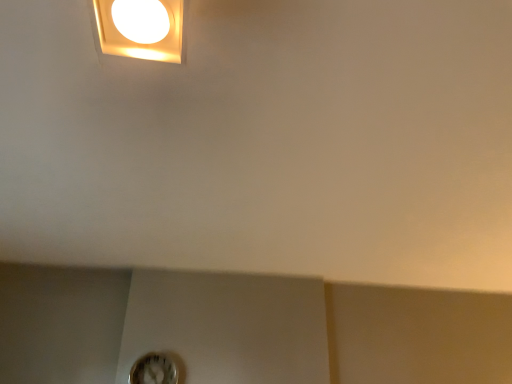
The height and width of the screenshot is (384, 512). What do you see at coordinates (141, 28) in the screenshot? I see `white plastic light fixture at upper left` at bounding box center [141, 28].

Find the location of `white plastic light fixture at upper left`. white plastic light fixture at upper left is located at coordinates (141, 28).

Consider the image. What is the approximate width of white plastic light fixture at upper left?

white plastic light fixture at upper left is 18.30 centimeters in width.

What do you see at coordinates (154, 370) in the screenshot? I see `white plastic clock at lower center` at bounding box center [154, 370].

Locate an element on the screen. white plastic clock at lower center is located at coordinates (154, 370).

Where is `white plastic light fixture at upper left`? The width and height of the screenshot is (512, 384). white plastic light fixture at upper left is located at coordinates (141, 28).

Does white plastic clock at lower center appear on the right side of white plastic light fixture at upper left?

No.

In the scene shown: Considering the positions of objects white plastic clock at lower center and white plastic light fixture at upper left in the image provided, who is in front, white plastic clock at lower center or white plastic light fixture at upper left?

white plastic light fixture at upper left is in front.

Which is nearer, (162, 362) or (165, 3)?

The point (165, 3) is in front.

From the image's perspective, which object appears higher, white plastic clock at lower center or white plastic light fixture at upper left?

white plastic light fixture at upper left appears higher in the image.

From a real-world perspective, is white plastic clock at lower center beneath white plastic light fixture at upper left?

Yes, from a real-world perspective, white plastic clock at lower center is under white plastic light fixture at upper left.

Considering the relative sizes of white plastic clock at lower center and white plastic light fixture at upper left in the image provided, is white plastic clock at lower center thinner than white plastic light fixture at upper left?

Yes.

Who is taller, white plastic clock at lower center or white plastic light fixture at upper left?

white plastic clock at lower center is taller.

Who is bigger, white plastic clock at lower center or white plastic light fixture at upper left?

white plastic light fixture at upper left.

Based on the photo, is white plastic clock at lower center positioned beyond the bounds of white plastic light fixture at upper left?

white plastic clock at lower center is positioned outside white plastic light fixture at upper left.

From the picture: Is white plastic clock at lower center placed right next to white plastic light fixture at upper left?

No, white plastic clock at lower center is not with white plastic light fixture at upper left.

Could you tell me if white plastic clock at lower center is facing white plastic light fixture at upper left?

Yes, white plastic clock at lower center is turned towards white plastic light fixture at upper left.

How different are the orientations of white plastic clock at lower center and white plastic light fixture at upper left in degrees?

white plastic clock at lower center and white plastic light fixture at upper left are facing 0.572 degrees away from each other.

At what (x,y) coordinates should I click in order to perform the action: click on lamp that is in front of the white plastic clock at lower center. Please return your answer as a coordinate pair (x, y). The width and height of the screenshot is (512, 384). Looking at the image, I should click on (141, 28).

Is white plastic light fixture at upper left to the left or to the right of white plastic clock at lower center in the image?

white plastic light fixture at upper left is positioned on white plastic clock at lower center's right side.

Which object is closer to the camera taking this photo, white plastic light fixture at upper left or white plastic clock at lower center?

Positioned in front is white plastic light fixture at upper left.

Is point (108, 0) farther from viewer compared to point (169, 378)?

That is False.

From the image's perspective, who appears lower, white plastic light fixture at upper left or white plastic clock at lower center?

white plastic clock at lower center is shown below in the image.

From a real-world perspective, between white plastic light fixture at upper left and white plastic clock at lower center, who is vertically higher?

From a 3D spatial view, white plastic light fixture at upper left is above.

Is white plastic light fixture at upper left wider or thinner than white plastic clock at lower center?

white plastic light fixture at upper left is wider than white plastic clock at lower center.

Considering the relative sizes of white plastic light fixture at upper left and white plastic clock at lower center in the image provided, is white plastic light fixture at upper left taller than white plastic clock at lower center?

Incorrect, the height of white plastic light fixture at upper left is not larger of that of white plastic clock at lower center.

Who is smaller, white plastic light fixture at upper left or white plastic clock at lower center?

With smaller size is white plastic clock at lower center.

Choose the correct answer: Is white plastic light fixture at upper left inside white plastic clock at lower center or outside it?

white plastic light fixture at upper left exists outside the volume of white plastic clock at lower center.

Is white plastic light fixture at upper left not close to white plastic clock at lower center?

white plastic light fixture at upper left is far away from white plastic clock at lower center.

Is white plastic light fixture at upper left facing towards white plastic clock at lower center?

No.

Can you tell me how much white plastic light fixture at upper left and white plastic clock at lower center differ in facing direction?

They differ by 0.572 degrees in their facing directions.

This screenshot has width=512, height=384. What are the coordinates of `clock on the left side of white plastic light fixture at upper left` in the screenshot? It's located at (154, 370).

The image size is (512, 384). I want to click on lamp above the white plastic clock at lower center (from the image's perspective), so click(x=141, y=28).

The width and height of the screenshot is (512, 384). Find the location of `clock on the left of white plastic light fixture at upper left`. clock on the left of white plastic light fixture at upper left is located at coordinates (154, 370).